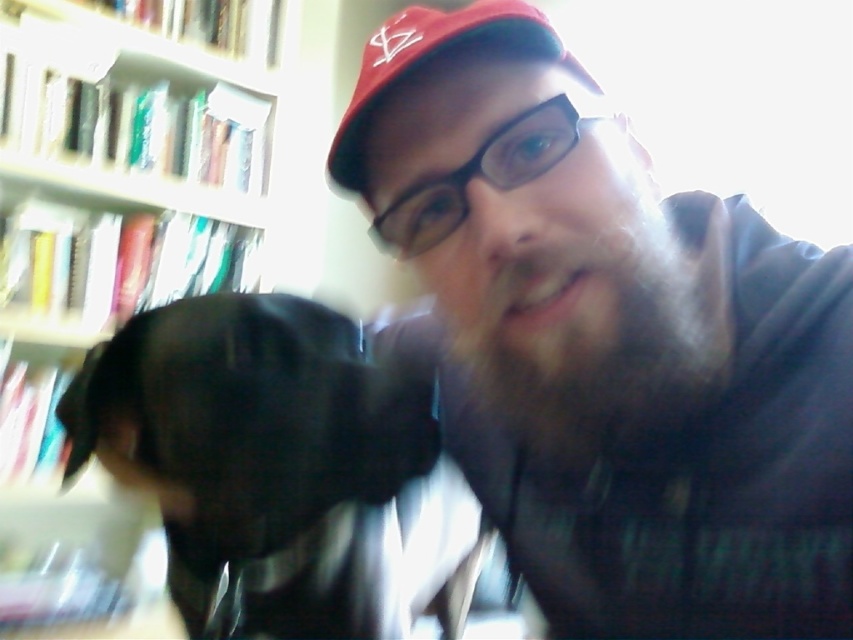
You are holding a smartphone to take a selfie in a room with a bookshelf and a matte black dog at lower left. If the dog moves closer to you by 10 centimeters, will it be within the camera frame?

The matte black dog at lower left is currently 44.25 centimeters away from the viewer. If it moves closer by 10 centimeters, the new distance would be 34.25 centimeters. Since smartphones typically have a minimum focusing distance of around 30 centimeters, the dog would be too close to be in focus and within the frame.

You are a photographer trying to capture a clear shot of the wooden bookshelf at left and the red matte baseball cap at upper center. Since the lighting is bright, you want to adjust your camera settings to avoid overexposure. Which object should you focus on first to ensure proper exposure?

The wooden bookshelf at left is much taller than the red matte baseball cap at upper center, so focusing on the larger wooden bookshelf at left first would help achieve proper exposure for the entire scene.

You are a photographer trying to capture a group photo of the person and their dog. Based on their current positions in the image, which direction should you move the black fur dog at left so it appears to the right of the matte skin nose at center?

You should move the black fur dog at left to the right so it appears to the right of the matte skin nose at center.